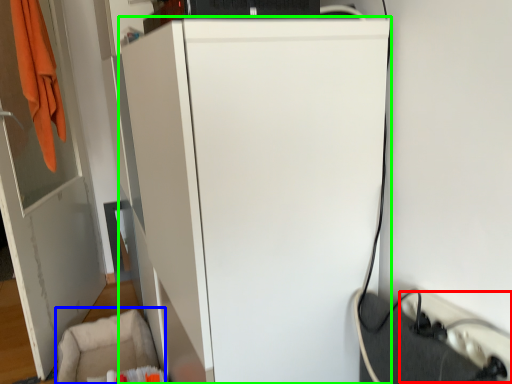
Question: Estimate the real-world distances between objects in this image. Which object is closer to extension cord (highlighted by a red box), swivel chair (highlighted by a blue box) or refrigerator (highlighted by a green box)?

Choices:
 (A) swivel chair
 (B) refrigerator

Answer: (B)